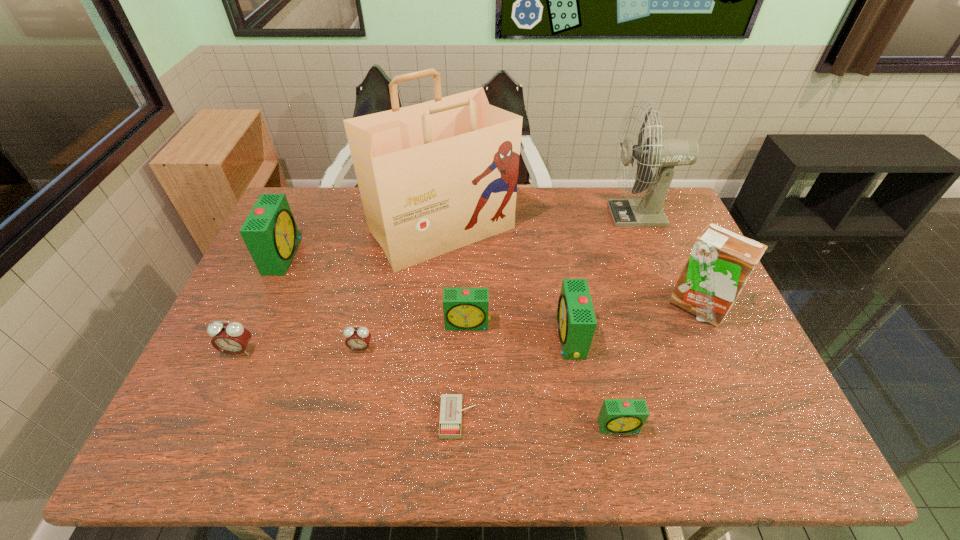
Identify the location of free location located on the striking surface of the white matchbox. (538, 418).

Locate an element on the screen. grocery bag that is at the far edge is located at coordinates (433, 177).

You are a GUI agent. You are given a task and a screenshot of the screen. Output one action in this format:
    pyautogui.click(x=<x>, y=<y>)
    Task: Click on the fan situated at the far edge
    This screenshot has width=960, height=540.
    Given the screenshot: What is the action you would take?
    pyautogui.click(x=665, y=153)

Find the location of a particular element. The image size is (960, 540). alarm clock located in the near edge section of the desktop is located at coordinates (616, 415).

Locate an element on the screen. matchbox located in the near edge section of the desktop is located at coordinates (450, 423).

Identify the location of fan that is at the right edge. (665, 153).

Locate an element on the screen. Image resolution: width=960 pixels, height=540 pixels. carton positioned at the right edge is located at coordinates (721, 261).

Find the location of a particular element. This screenshot has height=540, width=960. object present at the far right corner is located at coordinates (665, 153).

The height and width of the screenshot is (540, 960). I want to click on vacant space at the far edge of the desktop, so click(617, 191).

At what (x,y) coordinates should I click in order to perform the action: click on free space at the right edge of the desktop. Please return your answer as a coordinate pair (x, y). This screenshot has height=540, width=960. Looking at the image, I should click on (660, 253).